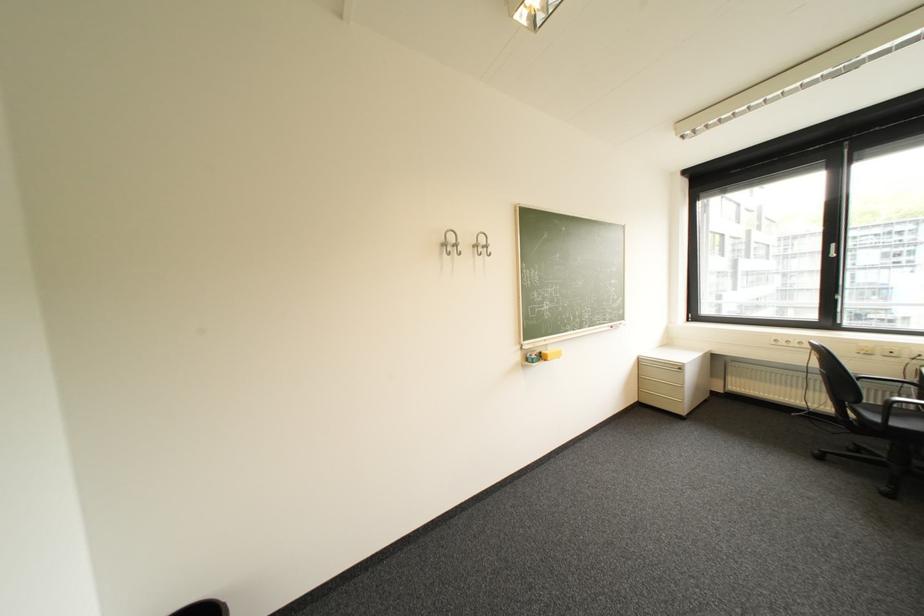
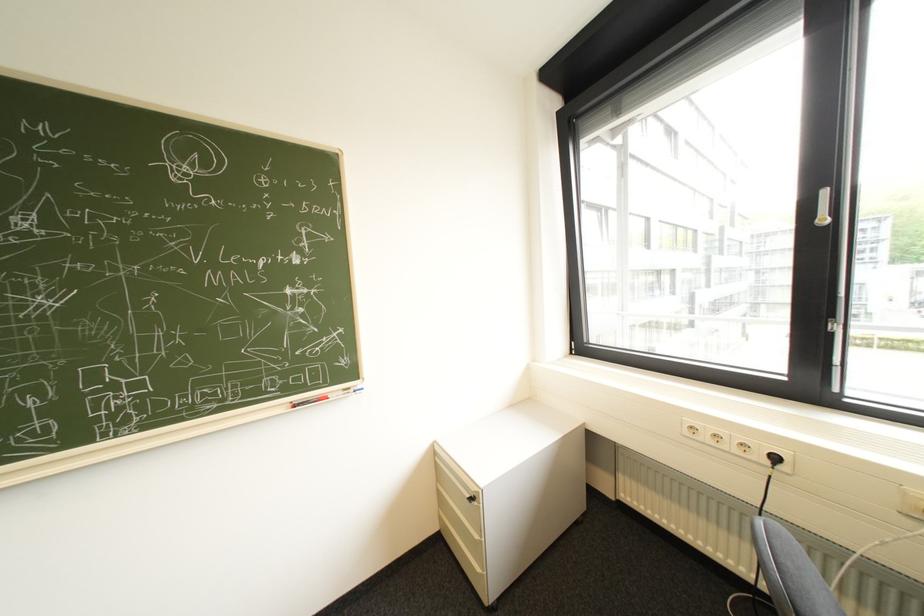
The images are taken continuously from a first-person perspective. In which direction are you moving?

The cameraman moved toward right, forward.